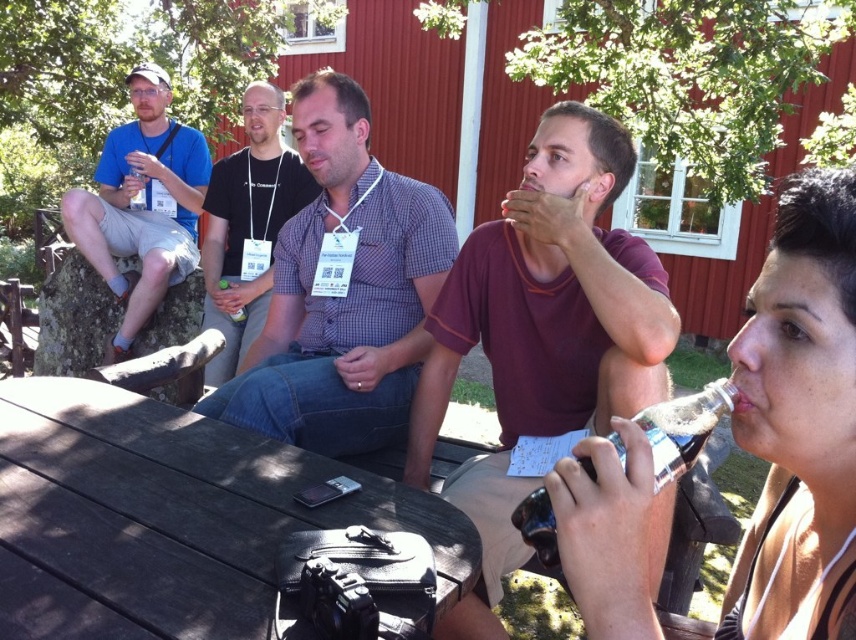
You are part of the group at the picnic table and want to greet the person wearing the checkered fabric shirt at center. Which direction should you look relative to the person in the matte blue shirt at left?

The checkered fabric shirt at center is to the right of the matte blue shirt at left, so you should look to the right of the person in the matte blue shirt at left to greet them.